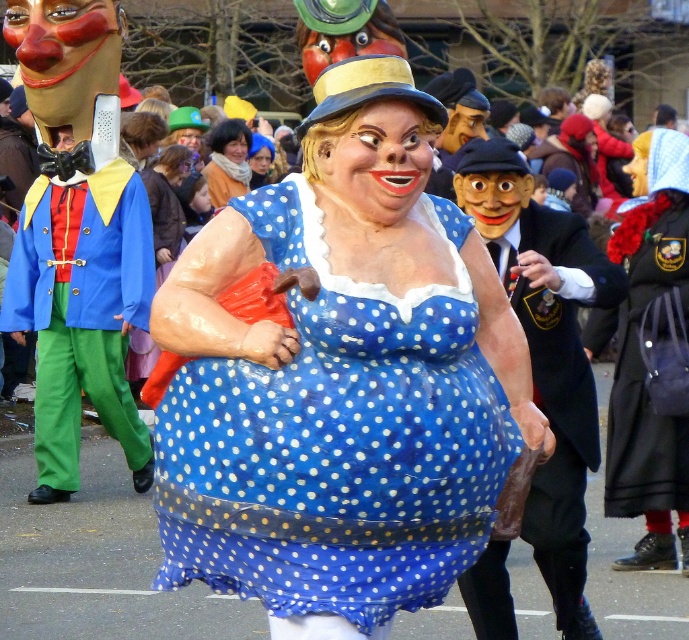
Is point (442, 550) less distant than point (637, 470)?

Yes, it is in front of point (637, 470).

The height and width of the screenshot is (640, 689). What do you see at coordinates (336, 440) in the screenshot? I see `blue polka dot fabric dress at center` at bounding box center [336, 440].

Is point (285, 429) behind point (647, 451)?

No.

You are a GUI agent. You are given a task and a screenshot of the screen. Output one action in this format:
    pyautogui.click(x=<x>, y=<y>)
    Task: Click on the blue polka dot fabric dress at center
    Image resolution: width=689 pixels, height=640 pixels.
    Given the screenshot: What is the action you would take?
    pyautogui.click(x=336, y=440)

Is black woolen coat at center below blue polka dot dress at center?

Yes, black woolen coat at center is below blue polka dot dress at center.

Does black woolen coat at center have a lesser height compared to blue polka dot dress at center?

Incorrect, black woolen coat at center's height does not fall short of blue polka dot dress at center's.

Locate an element on the screen. This screenshot has width=689, height=640. black woolen coat at center is located at coordinates (650, 355).

Which is in front, point (308, 412) or point (156, 237)?

Positioned in front is point (308, 412).

Image resolution: width=689 pixels, height=640 pixels. I want to click on blue polka dot fabric dress at center, so click(336, 440).

Where is `blue polka dot fabric dress at center`? Image resolution: width=689 pixels, height=640 pixels. blue polka dot fabric dress at center is located at coordinates (336, 440).